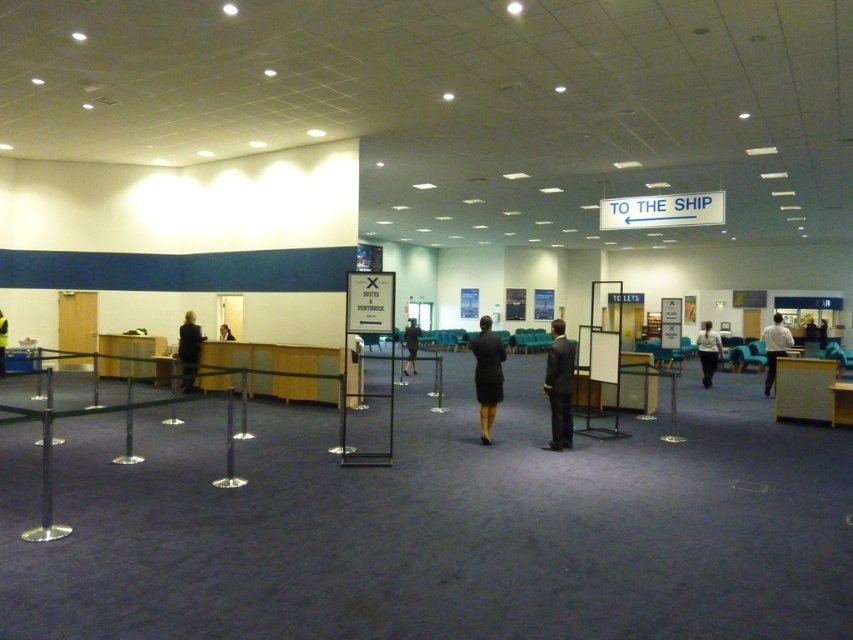
Question: Does black suit at left have a greater width compared to black fabric coat at center?

Choices:
 (A) yes
 (B) no

Answer: (B)

Question: Which point is closer to the camera?

Choices:
 (A) black suit at left
 (B) white shirt at center
 (C) wooden desk at center

Answer: (C)

Question: Is matte black dress at center thinner than black fabric coat at center?

Choices:
 (A) no
 (B) yes

Answer: (A)

Question: Is dark suit at center to the left of white shirt at center from the viewer's perspective?

Choices:
 (A) no
 (B) yes

Answer: (B)

Question: Which of the following is the closest to the observer?

Choices:
 (A) black suit at center
 (B) matte black dress at center
 (C) wooden desk at left

Answer: (B)

Question: Among these objects, which one is farthest from the camera?

Choices:
 (A) wooden desk at center
 (B) dark suit at center
 (C) matte black dress at center
 (D) light brown wooden desk at center

Answer: (A)